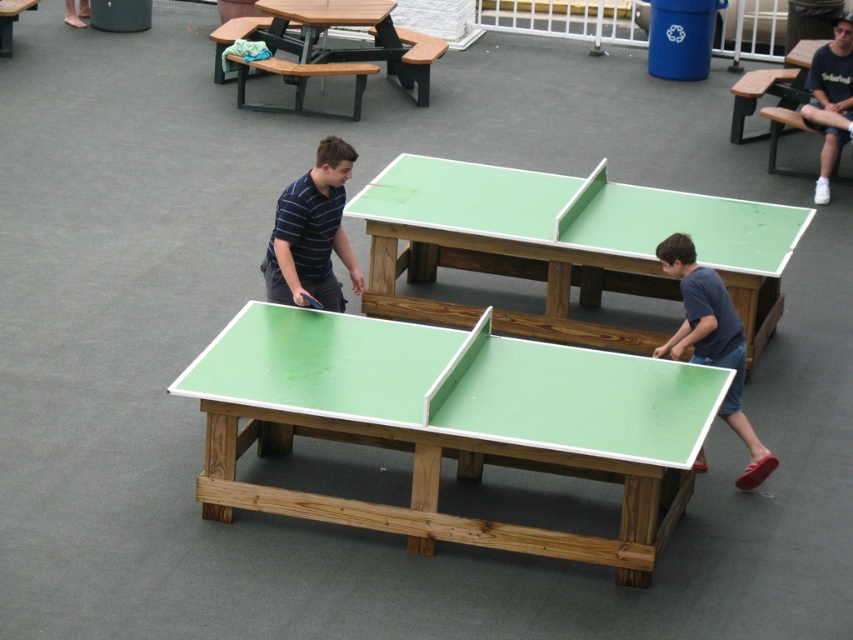
Question: Which object is closer to the camera taking this photo?

Choices:
 (A) striped cotton shirt at center
 (B) green wooden ping pong table at center
 (C) blue fabric shirt at lower right

Answer: (C)

Question: Which of the following is the closest to the observer?

Choices:
 (A) striped cotton shirt at center
 (B) rubber green table tennis at lower right
 (C) green wooden picnic table at upper center

Answer: (B)

Question: In this image, where is green matte table tennis table at center located relative to green wooden ping pong table at center?

Choices:
 (A) below
 (B) above

Answer: (A)

Question: Does green matte table tennis table at center have a smaller size compared to green wooden table tennis table at center?

Choices:
 (A) yes
 (B) no

Answer: (B)

Question: Which of the following is the closest to the observer?

Choices:
 (A) rubber green table tennis at lower right
 (B) green wooden picnic table at upper center
 (C) green wooden ping pong table at center

Answer: (A)

Question: Does green matte table tennis table at center come behind green wooden picnic table at upper center?

Choices:
 (A) yes
 (B) no

Answer: (B)